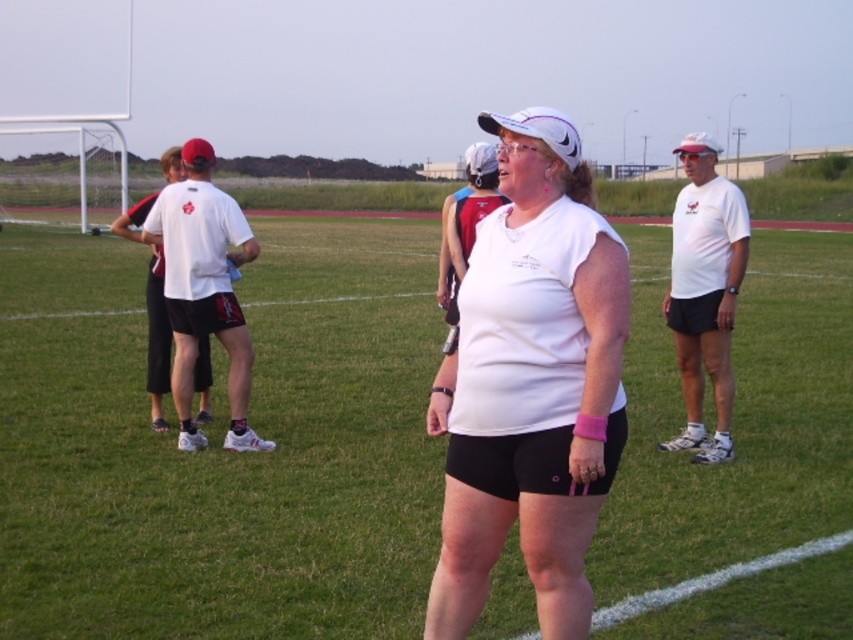
Can you confirm if green grass at center is wider than white matte t-shirt at center?

Yes, green grass at center is wider than white matte t-shirt at center.

Is point (372, 433) positioned before point (451, 540)?

No.

You are a GUI agent. You are given a task and a screenshot of the screen. Output one action in this format:
    pyautogui.click(x=<x>, y=<y>)
    Task: Click on the green grass at center
    The image size is (853, 640).
    Given the screenshot: What is the action you would take?
    pyautogui.click(x=219, y=445)